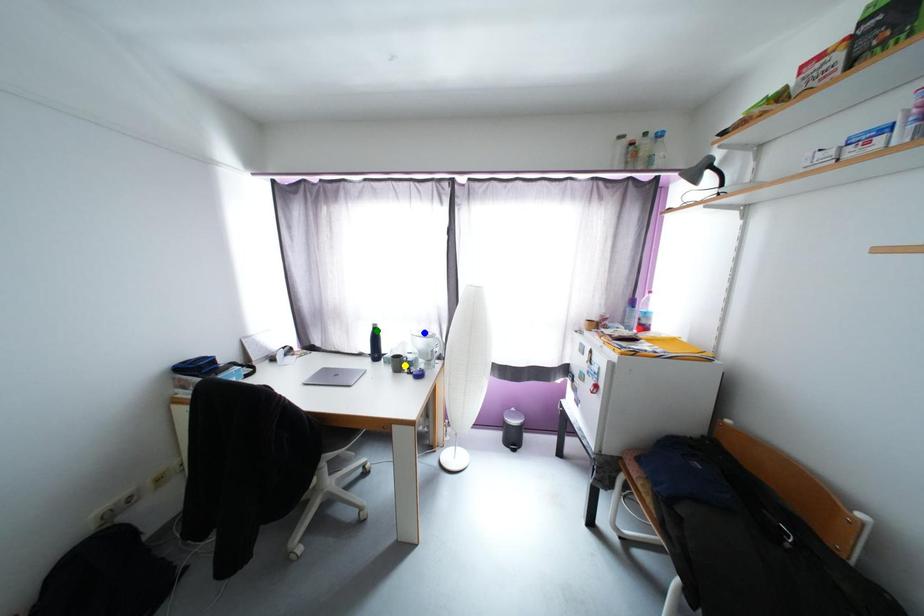
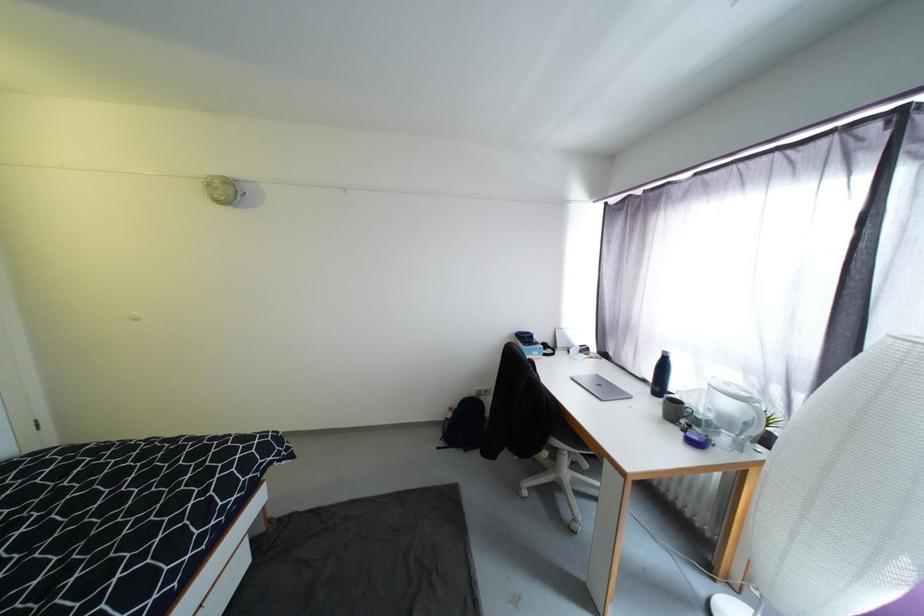
I am providing you with two images of the same scene from different viewpoints. Three points are marked in image1. Which point corresponds to a part or object that is occluded in image2?In image1, three points are marked. Which of them correspond to a part or object that is occluded in image2?Among the three points shown in image1, which one corresponds to a part or object that is no longer visible due to occlusion in image2?

Invisible in image2: green point.